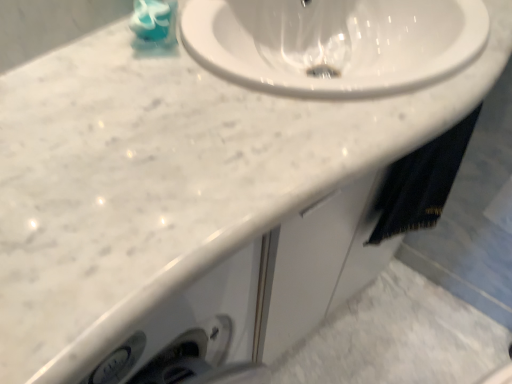
You are a GUI agent. You are given a task and a screenshot of the screen. Output one action in this format:
    pyautogui.click(x=<x>, y=<y>)
    Task: Click on the black fabric towel at lower right
    Image resolution: width=512 pixels, height=384 pixels.
    Given the screenshot: What is the action you would take?
    pyautogui.click(x=422, y=183)

Image resolution: width=512 pixels, height=384 pixels. Describe the element at coordinates (422, 183) in the screenshot. I see `black fabric towel at lower right` at that location.

Locate an element on the screen. The width and height of the screenshot is (512, 384). teal glossy soap at upper left is located at coordinates (153, 24).

This screenshot has height=384, width=512. What do you see at coordinates (153, 24) in the screenshot?
I see `teal glossy soap at upper left` at bounding box center [153, 24].

At what (x,y) coordinates should I click in order to perform the action: click on black fabric towel at lower right. Please return your answer as a coordinate pair (x, y). This screenshot has width=512, height=384. Looking at the image, I should click on (422, 183).

Is teal glossy soap at upper left to the right of black fabric towel at lower right from the viewer's perspective?

In fact, teal glossy soap at upper left is to the left of black fabric towel at lower right.

Which object is further away from the camera taking this photo, teal glossy soap at upper left or black fabric towel at lower right?

black fabric towel at lower right is further away from the camera.

Does point (170, 26) come closer to viewer compared to point (378, 232)?

That is True.

From the image's perspective, is teal glossy soap at upper left above or below black fabric towel at lower right?

teal glossy soap at upper left is above black fabric towel at lower right.

From a real-world perspective, is teal glossy soap at upper left physically above black fabric towel at lower right?

Yes, from a real-world perspective, teal glossy soap at upper left is on top of black fabric towel at lower right.

Is teal glossy soap at upper left wider than black fabric towel at lower right?

Yes.

Is teal glossy soap at upper left shorter than black fabric towel at lower right?

Yes, teal glossy soap at upper left is shorter than black fabric towel at lower right.

Does teal glossy soap at upper left have a larger size compared to black fabric towel at lower right?

No, teal glossy soap at upper left is not bigger than black fabric towel at lower right.

Would you say teal glossy soap at upper left contains black fabric towel at lower right?

No, black fabric towel at lower right is not inside teal glossy soap at upper left.

Is the surface of teal glossy soap at upper left in direct contact with black fabric towel at lower right?

teal glossy soap at upper left is not next to black fabric towel at lower right, and they're not touching.

Is teal glossy soap at upper left facing towards black fabric towel at lower right?

No, teal glossy soap at upper left is not oriented towards black fabric towel at lower right.

How different are the orientations of teal glossy soap at upper left and black fabric towel at lower right in degrees?

There is a 17.9-degree angle between the facing directions of teal glossy soap at upper left and black fabric towel at lower right.

Locate an element on the screen. bath towel on the right of teal glossy soap at upper left is located at coordinates (422, 183).

Consider the image. Is black fabric towel at lower right to the left of teal glossy soap at upper left from the viewer's perspective?

No, black fabric towel at lower right is not to the left of teal glossy soap at upper left.

Who is more distant, black fabric towel at lower right or teal glossy soap at upper left?

black fabric towel at lower right is behind.

Is point (468, 131) closer to viewer compared to point (159, 31)?

No.

From the image's perspective, which object appears higher, black fabric towel at lower right or teal glossy soap at upper left?

teal glossy soap at upper left is shown above in the image.

From a real-world perspective, is black fabric towel at lower right above or below teal glossy soap at upper left?

black fabric towel at lower right is below teal glossy soap at upper left.

Looking at their sizes, would you say black fabric towel at lower right is wider or thinner than teal glossy soap at upper left?

Considering their sizes, black fabric towel at lower right looks slimmer than teal glossy soap at upper left.

Which of these two, black fabric towel at lower right or teal glossy soap at upper left, stands taller?

Standing taller between the two is black fabric towel at lower right.

Between black fabric towel at lower right and teal glossy soap at upper left, which one has smaller size?

teal glossy soap at upper left.

Would you say black fabric towel at lower right is outside teal glossy soap at upper left?

Yes.

Are black fabric towel at lower right and teal glossy soap at upper left making contact?

No, black fabric towel at lower right is not in contact with teal glossy soap at upper left.

Could you tell me if black fabric towel at lower right is turned towards teal glossy soap at upper left?

No.

How far apart are black fabric towel at lower right and teal glossy soap at upper left?

They are 21.90 inches apart.

Image resolution: width=512 pixels, height=384 pixels. Identify the location of bath towel on the right of teal glossy soap at upper left. (422, 183).

Find the location of a particular element. This screenshot has width=512, height=384. liquid above the black fabric towel at lower right (from a real-world perspective) is located at coordinates (153, 24).

You are a GUI agent. You are given a task and a screenshot of the screen. Output one action in this format:
    pyautogui.click(x=<x>, y=<y>)
    Task: Click on the liquid that appears above the black fabric towel at lower right (from the image's perspective)
    This screenshot has height=384, width=512.
    Given the screenshot: What is the action you would take?
    pyautogui.click(x=153, y=24)